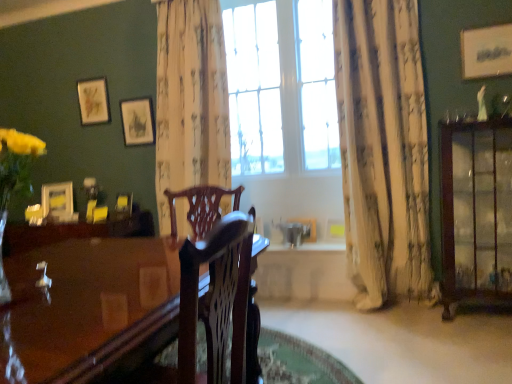
This screenshot has width=512, height=384. I want to click on free space that is to the left of brown wood cabinet at right, so click(423, 328).